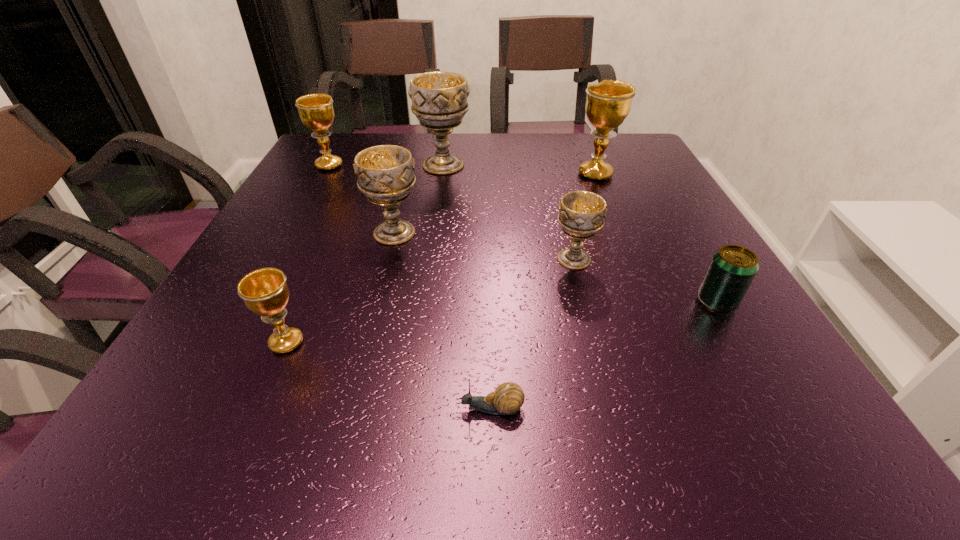
The height and width of the screenshot is (540, 960). In order to click on free space between the rightmost gold chalice and the leftmost object in this screenshot , I will do `click(463, 170)`.

The height and width of the screenshot is (540, 960). I want to click on vacant area that lies between the escargot and the leftmost chalice, so click(410, 287).

Where is `empty location between the second biggest white chalice and the rightmost white chalice`? empty location between the second biggest white chalice and the rightmost white chalice is located at coordinates (484, 246).

Image resolution: width=960 pixels, height=540 pixels. Identify the location of empty space between the rightmost white chalice and the nearest object. (532, 334).

Find the location of a particular element. The image size is (960, 540). vacant area that lies between the shortest object and the biggest white chalice is located at coordinates (467, 287).

This screenshot has height=540, width=960. In order to click on object that is the fifth nearest to the shortest object in this screenshot , I will do `click(608, 103)`.

You are a GUI agent. You are given a task and a screenshot of the screen. Output one action in this format:
    pyautogui.click(x=<x>, y=<y>)
    Task: Click on the object that is the fifth closest one to the rightmost chalice
    The image size is (960, 540).
    Given the screenshot: What is the action you would take?
    pyautogui.click(x=316, y=111)

Identify the location of the fifth closest chalice to the smallest white chalice. This screenshot has width=960, height=540. (316, 111).

Identify which chalice is located as the fourth nearest to the farthest white chalice. Please provide its 2D coordinates. Your answer should be formatted as a tuple, i.e. [(x, y)], where the tuple contains the x and y coordinates of a point satisfying the conditions above.

[(582, 213)]

At what (x,y) coordinates should I click in order to perform the action: click on the closest white chalice to the nearest chalice. Please return your answer as a coordinate pair (x, y). This screenshot has width=960, height=540. Looking at the image, I should click on (385, 174).